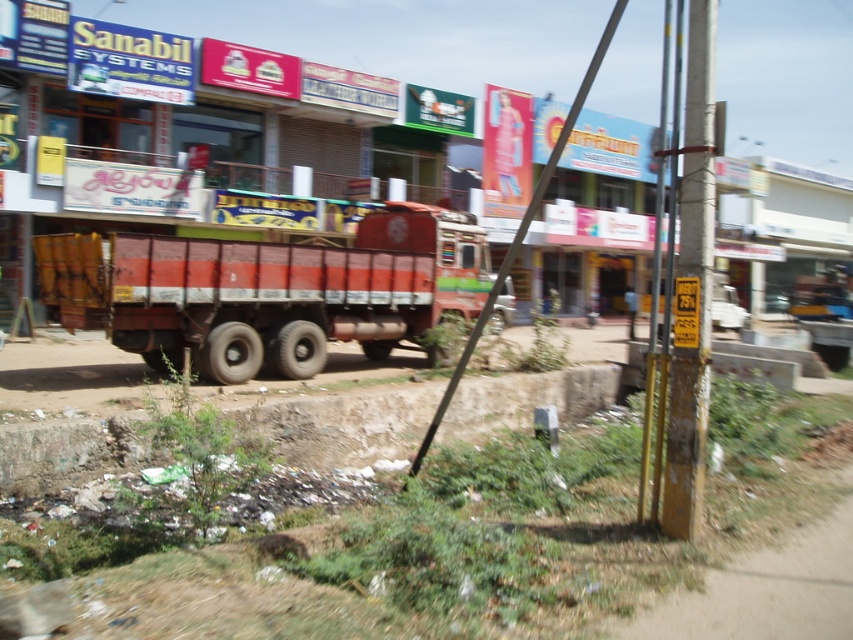
Question: Can you confirm if brown dirt at lower left is positioned to the right of metallic pole at right?

Choices:
 (A) no
 (B) yes

Answer: (A)

Question: Is red matte truck at center above yellow painted wood pole at right?

Choices:
 (A) no
 (B) yes

Answer: (A)

Question: Is red matte truck at center positioned behind brown dirt at lower left?

Choices:
 (A) no
 (B) yes

Answer: (B)

Question: Which point is closer to the camera?

Choices:
 (A) yellow painted wood pole at right
 (B) metallic pole at right

Answer: (A)

Question: Which object is farther from the camera taking this photo?

Choices:
 (A) brown dirt at lower left
 (B) yellow painted wood pole at right
 (C) metallic pole at right

Answer: (C)

Question: Among these points, which one is nearest to the camera?

Choices:
 (A) (662, 513)
 (B) (427, 305)
 (C) (422, 394)

Answer: (A)